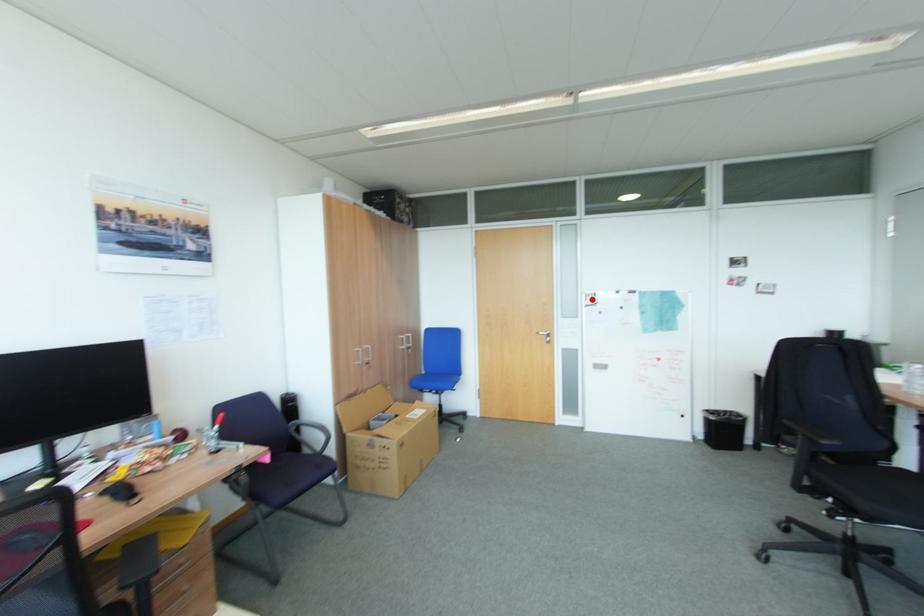
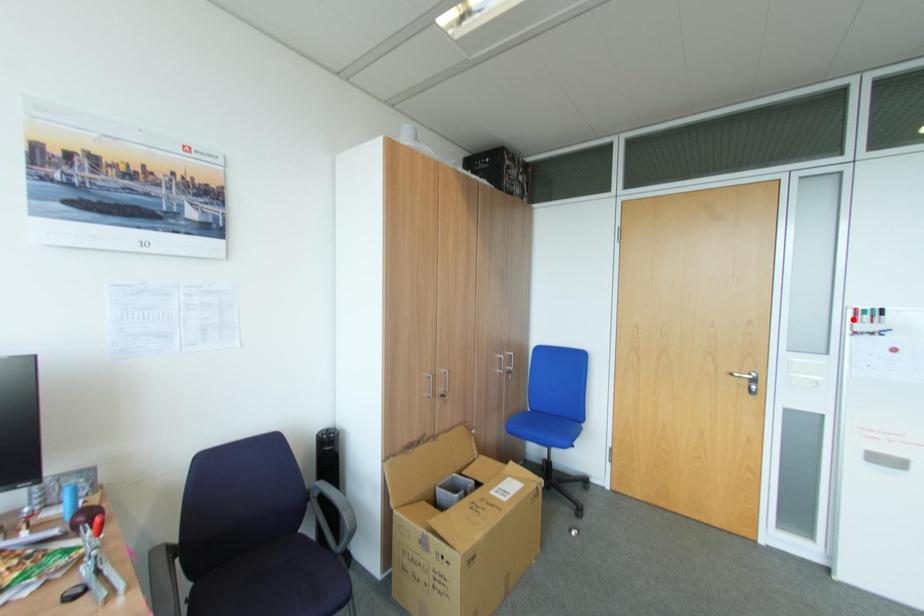
I am providing you with two images of the same scene from different viewpoints. A red point is marked on the first image and another point is marked on the second image. Is the marked point in image1 the same physical position as the marked point in image2?

No